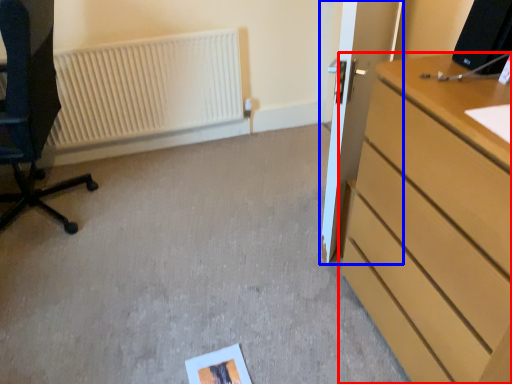
Question: Which object is closer to the camera taking this photo, chest of drawers (highlighted by a red box) or door (highlighted by a blue box)?

Choices:
 (A) chest of drawers
 (B) door

Answer: (A)